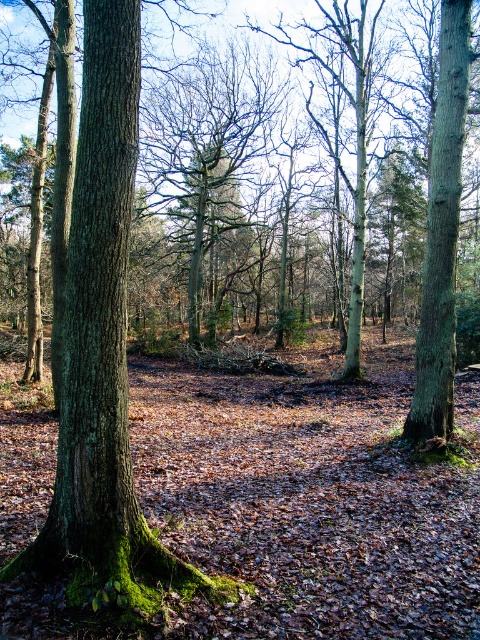
You are a hiker standing in the woodland scene and want to move from point A to point B. Point A is at coordinates point (282, 84) and point B is at point (445, 115). Which point is closer to you?

Point (282, 84) is closer to you than point (445, 115) because it is further to the viewer.

Looking at this image, you are a hiker who wants to identify the trees in the forest. You notice two tree trunks, the green mossy bark tree trunk at left and the green rough bark tree trunk at right. Which tree trunk takes up more space in the image?

The green rough bark tree trunk at right takes up more space in the image than the green mossy bark tree trunk at left.